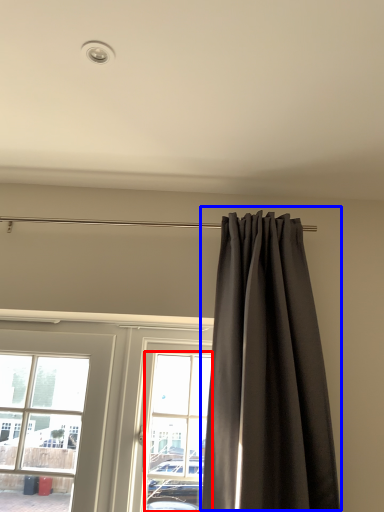
Question: Which object is further to the camera taking this photo, bay window (highlighted by a red box) or curtain (highlighted by a blue box)?

Choices:
 (A) bay window
 (B) curtain

Answer: (A)